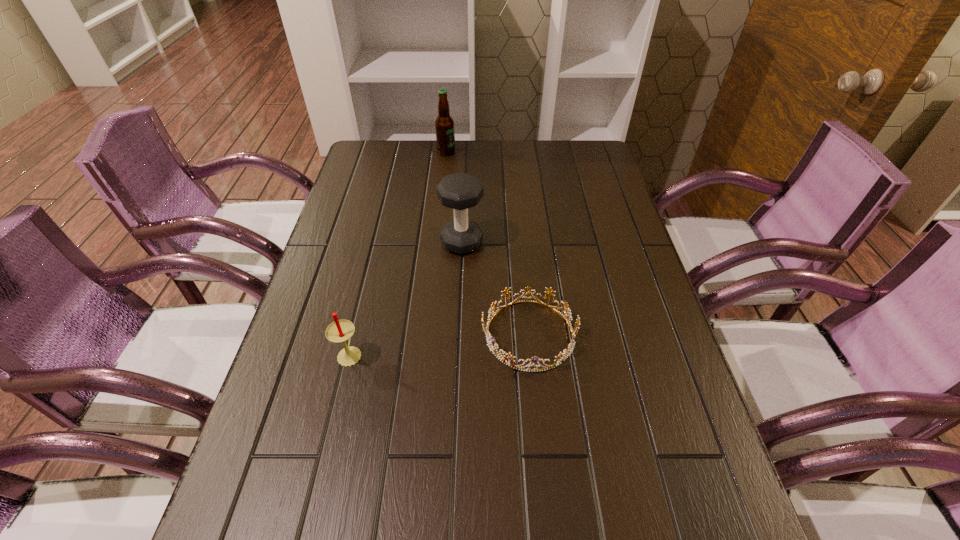
What are the coordinates of `beer bottle` in the screenshot? It's located at pyautogui.click(x=445, y=135).

Image resolution: width=960 pixels, height=540 pixels. Identify the location of the second farthest object. (460, 191).

Where is `the leftmost object`? Image resolution: width=960 pixels, height=540 pixels. the leftmost object is located at coordinates (339, 331).

Identify the location of candle. Image resolution: width=960 pixels, height=540 pixels. (339, 331).

Find the location of a particular element. Image resolution: width=960 pixels, height=540 pixels. tiara is located at coordinates (560, 358).

Find the location of `free region located on the label of the farthest object`. free region located on the label of the farthest object is located at coordinates (512, 152).

Image resolution: width=960 pixels, height=540 pixels. In order to click on vacant point located 0.120m on the left of the dumbbell in this screenshot , I will do `click(397, 242)`.

This screenshot has height=540, width=960. What are the coordinates of `free space located on the back of the candle` in the screenshot? It's located at (361, 309).

At what (x,y) coordinates should I click in order to perform the action: click on vacant space located 0.290m on the front-facing side of the shortest object. Please return your answer as a coordinate pair (x, y). Looking at the image, I should click on (355, 334).

This screenshot has height=540, width=960. I want to click on free space located 0.190m on the front-facing side of the shortest object, so click(398, 334).